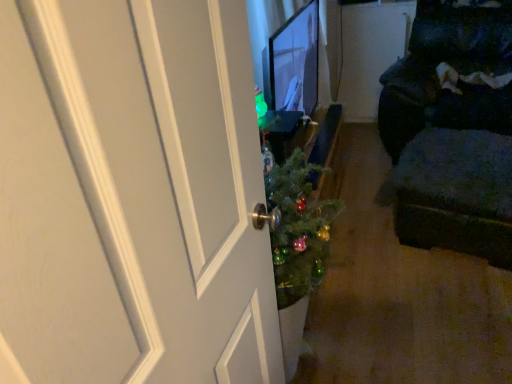
Question: Is dark fabric ottoman at right outside dark fabric couch at right?

Choices:
 (A) yes
 (B) no

Answer: (A)

Question: Can you confirm if dark fabric ottoman at right is smaller than dark fabric couch at right?

Choices:
 (A) yes
 (B) no

Answer: (A)

Question: Is dark fabric ottoman at right directly adjacent to dark fabric couch at right?

Choices:
 (A) yes
 (B) no

Answer: (B)

Question: Is dark fabric couch at right located within dark fabric ottoman at right?

Choices:
 (A) no
 (B) yes

Answer: (A)

Question: Is dark fabric ottoman at right wider than dark fabric couch at right?

Choices:
 (A) yes
 (B) no

Answer: (B)

Question: Looking at their shapes, would you say dark fabric couch at right is wider or thinner than matte black monitor at center?

Choices:
 (A) thin
 (B) wide

Answer: (B)

Question: In terms of height, does dark fabric couch at right look taller or shorter compared to matte black monitor at center?

Choices:
 (A) tall
 (B) short

Answer: (A)

Question: Is dark fabric couch at right in front of or behind matte black monitor at center in the image?

Choices:
 (A) behind
 (B) front

Answer: (A)

Question: From the image's perspective, is dark fabric couch at right located above or below matte black monitor at center?

Choices:
 (A) below
 (B) above

Answer: (B)

Question: Is dark fabric ottoman at right inside or outside of matte black monitor at center?

Choices:
 (A) inside
 (B) outside

Answer: (B)

Question: Considering the positions of dark fabric ottoman at right and matte black monitor at center in the image, is dark fabric ottoman at right wider or thinner than matte black monitor at center?

Choices:
 (A) wide
 (B) thin

Answer: (A)

Question: Is point (437, 144) closer or farther from the camera than point (317, 19)?

Choices:
 (A) farther
 (B) closer

Answer: (B)

Question: Relative to matte black monitor at center, is dark fabric ottoman at right in front or behind?

Choices:
 (A) behind
 (B) front

Answer: (A)

Question: Considering the positions of dark fabric ottoman at right and dark fabric couch at right in the image, is dark fabric ottoman at right wider or thinner than dark fabric couch at right?

Choices:
 (A) thin
 (B) wide

Answer: (A)

Question: Visually, is dark fabric ottoman at right positioned to the left or to the right of dark fabric couch at right?

Choices:
 (A) left
 (B) right

Answer: (A)